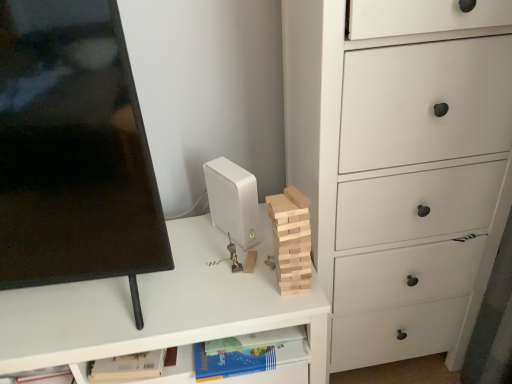
This screenshot has height=384, width=512. Identify the location of vacant space that is to the left of natural wood block at center. (232, 293).